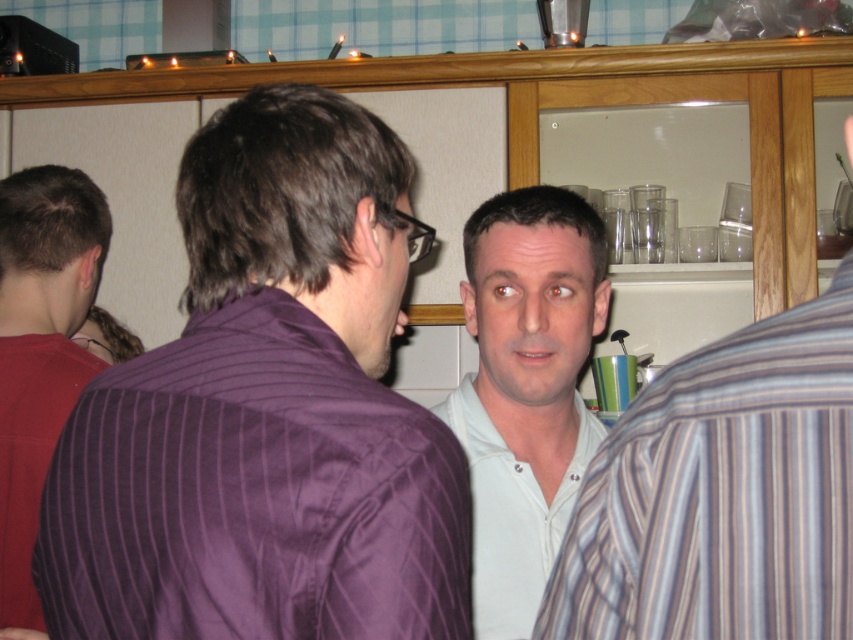
You are a photographer setting up for a group photo at the event. You notice two people wearing the purple striped shirt at center and the white cotton shirt at center. Since you want to ensure everyone is visible, which shirt should you position closer to the front to avoid blocking others?

The purple striped shirt at center is taller than the white cotton shirt at center, so positioning the white cotton shirt at center closer to the front would prevent the taller individual in the purple striped shirt at center from blocking others.

You are organizing a clothing donation drive and need to categorize shirts by size. You have a matte purple shirt at left and a white cotton shirt at center. Which shirt should you place in the large size bin?

The matte purple shirt at left has a larger size compared to the white cotton shirt at center, so it should be placed in the large size bin.